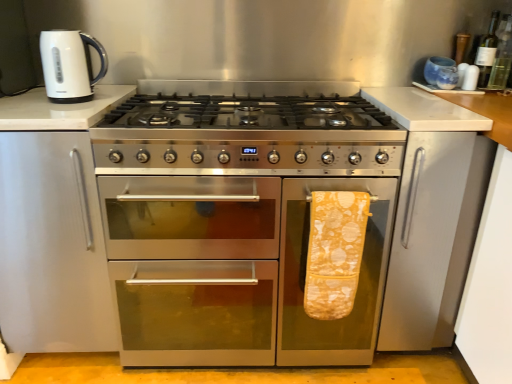
Question: Does point pos(481,79) appear closer or farther from the camera than point pos(345,208)?

Choices:
 (A) closer
 (B) farther

Answer: (B)

Question: Considering their positions, is green glass bottle at upper right, which ranks as the 2th bottle in right-to-left order, located in front of or behind yellow printed towel at right?

Choices:
 (A) behind
 (B) front

Answer: (A)

Question: Estimate the real-world distances between objects in this image. Which object is closer to the white glossy electric kettle at upper left?

Choices:
 (A) green glass bottle at upper right, the 1th bottle when ordered from left to right
 (B) green glass bottle at upper right, positioned as the second bottle in left-to-right order
 (C) stainless steel gas stove at center
 (D) yellow printed towel at right
 (E) stainless steel oven at center

Answer: (C)

Question: Which is nearer to the green glass bottle at upper right, placed as the 1th bottle when sorted from right to left?

Choices:
 (A) white glossy electric kettle at upper left
 (B) green glass bottle at upper right, the 1th bottle when ordered from left to right
 (C) stainless steel gas stove at center
 (D) yellow printed towel at right
 (E) stainless steel oven at center

Answer: (B)